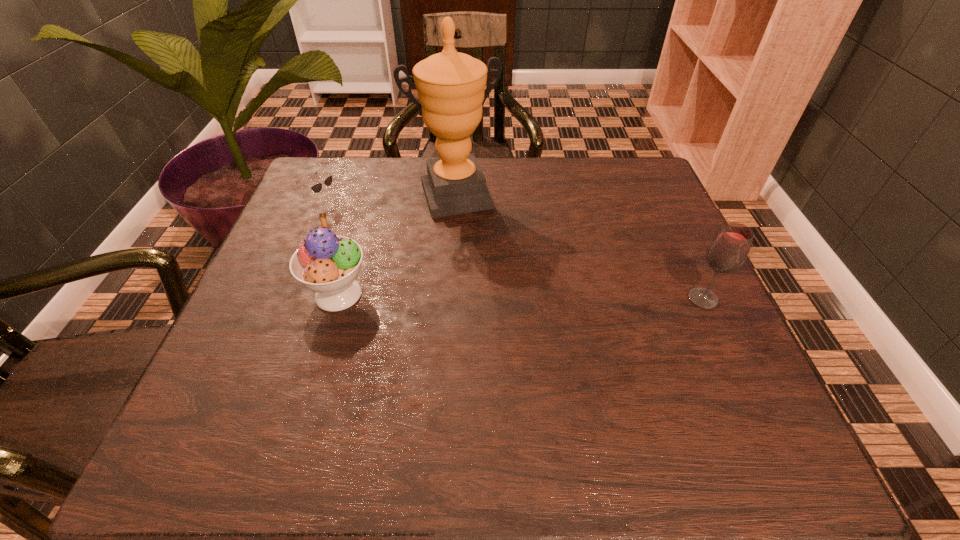
Where is `vacant spot on the desktop that is between the icecream and the glass drink container and is positioned in front of the lenses of the sunglasses`? This screenshot has height=540, width=960. vacant spot on the desktop that is between the icecream and the glass drink container and is positioned in front of the lenses of the sunglasses is located at coordinates (497, 296).

The width and height of the screenshot is (960, 540). I want to click on free space on the desktop that is between the icecream and the glass drink container and is positioned at the front of the tallest object with handles, so click(492, 296).